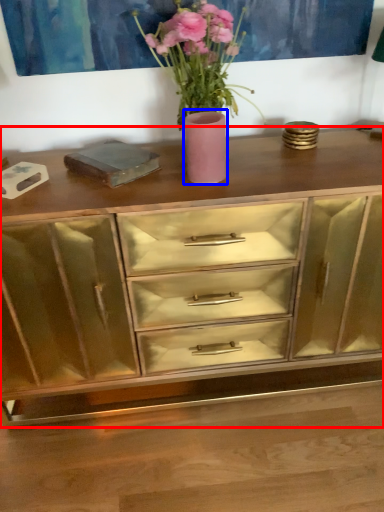
Question: Among these objects, which one is farthest to the camera, chest of drawers (highlighted by a red box) or vase (highlighted by a blue box)?

Choices:
 (A) chest of drawers
 (B) vase

Answer: (B)